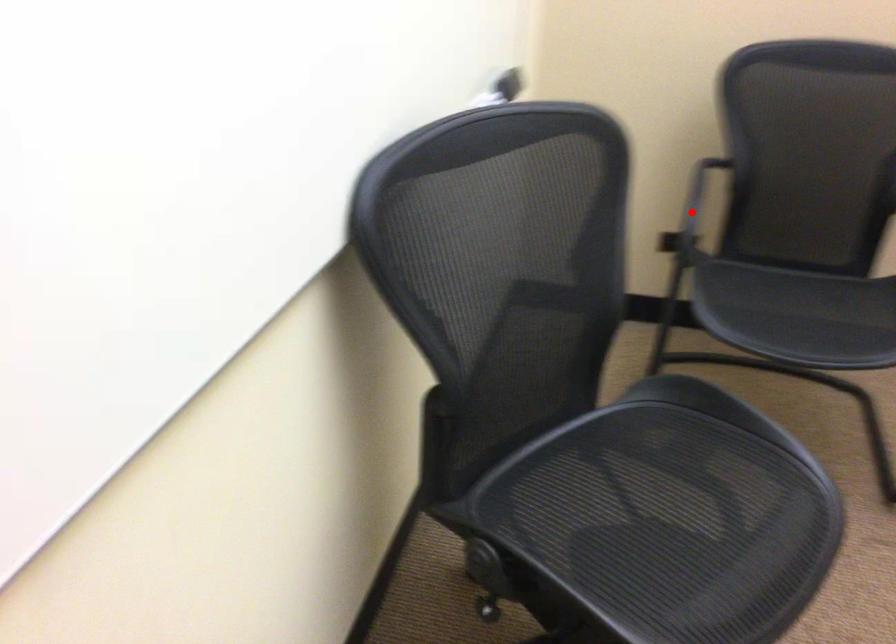
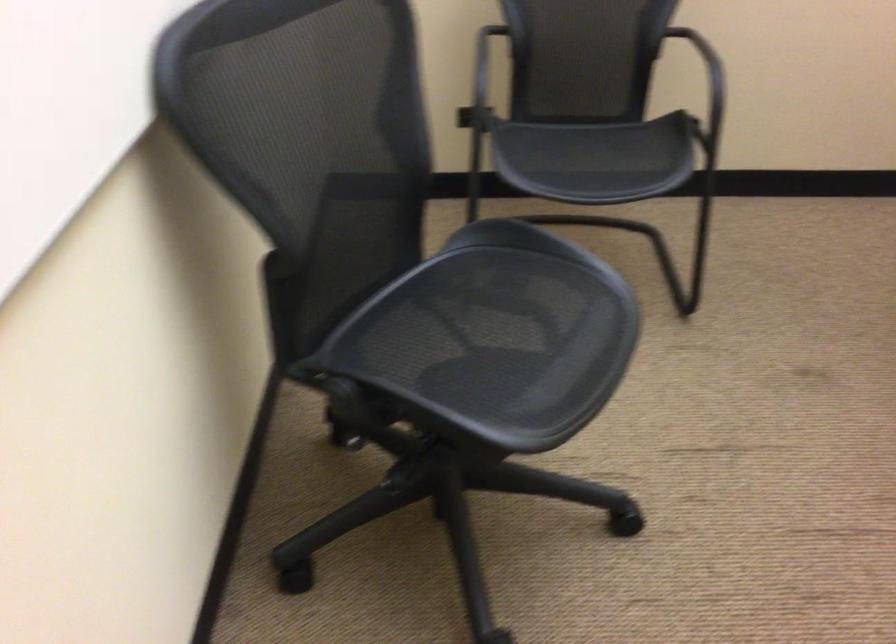
Question: I am providing you with two images of the same scene from different viewpoints. A red point is marked on the first image. Can you still see the location of the red point in image 2?

Choices:
 (A) Yes
 (B) No

Answer: (B)